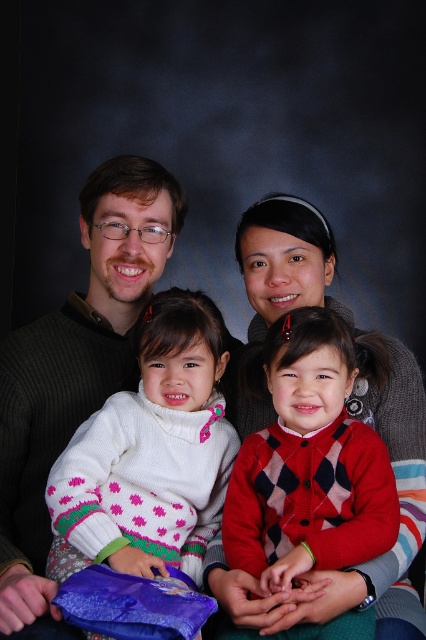
Question: Is white knitted sweater at center in front of red argyle sweater at center?

Choices:
 (A) yes
 (B) no

Answer: (B)

Question: From the image, what is the correct spatial relationship of dark gray sweater at left in relation to red argyle sweater at center?

Choices:
 (A) left
 (B) right

Answer: (A)

Question: Which point appears closest to the camera in this image?

Choices:
 (A) (150, 332)
 (B) (296, 419)

Answer: (B)

Question: Which of the following is the farthest from the observer?

Choices:
 (A) red argyle sweater at center
 (B) white knitted sweater at center
 (C) dark gray sweater at left

Answer: (C)

Question: Does dark gray sweater at left have a lesser width compared to red argyle sweater at center?

Choices:
 (A) yes
 (B) no

Answer: (B)

Question: Considering the real-world distances, which object is farthest from the white knitted sweater at center?

Choices:
 (A) red argyle sweater at center
 (B) dark gray sweater at left

Answer: (B)